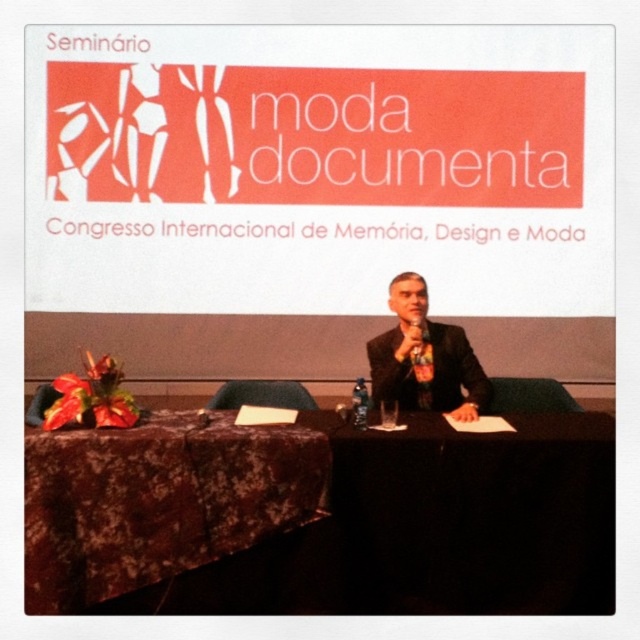
Consider the image. You are an event organizer who needs to place a 36 inch wide decorative panel between the velvet dark brown tablecloth at lower left and the black suit at center. Can the panel fit in the space between them?

The distance between the velvet dark brown tablecloth at lower left and the black suit at center is 38.43 inches. Since the panel is 36 inches wide, it can fit in the space between them as there is enough room.

You are attending the Moda Documenta Seminar and notice two items at the front of the room. The black fabric table at center and the black suit at center. Which one is positioned to the right of the other?

The black fabric table at center is to the right of the black suit at center.

You are organizing a presentation and need to place a large poster on the table. Which object, the black fabric table at center or the velvet dark brown tablecloth at lower left, is more suitable for placing a large poster due to its size?

The black fabric table at center is more suitable for placing a large poster because it might be wider than the velvet dark brown tablecloth at lower left.